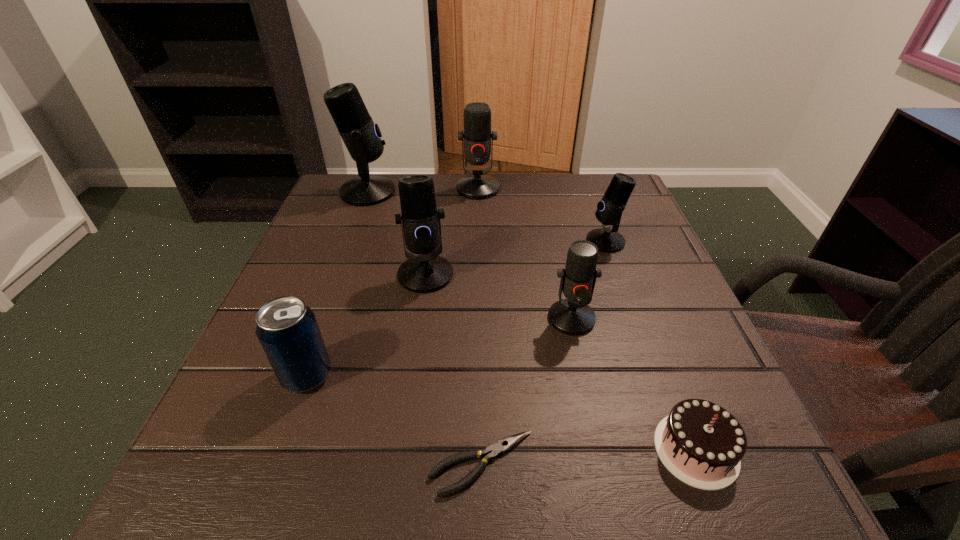
Identify which microphone is the third nearest to the bigger red microphone. Please provide its 2D coordinates. Your answer should be formatted as a tuple, i.e. [(x, y)], where the tuple contains the x and y coordinates of a point satisfying the conditions above.

[(427, 272)]

Identify the location of black microphone that is the nearest to the second nearest microphone. (361, 136).

The width and height of the screenshot is (960, 540). Identify the location of black microphone that stands as the second closest to the second nearest microphone. (609, 210).

Where is `vacant area in the image that satisfies the following two spatial constraints: 1. on the stand of the pliers; 2. on the left side of the fourth farthest microphone`? The height and width of the screenshot is (540, 960). vacant area in the image that satisfies the following two spatial constraints: 1. on the stand of the pliers; 2. on the left side of the fourth farthest microphone is located at coordinates (398, 463).

You are a GUI agent. You are given a task and a screenshot of the screen. Output one action in this format:
    pyautogui.click(x=<x>, y=<y>)
    Task: Click on the vacant space that satisfies the following two spatial constraints: 1. on the back side of the chocolate cake; 2. on the stand of the leftmost black microphone
    The height and width of the screenshot is (540, 960).
    Given the screenshot: What is the action you would take?
    pyautogui.click(x=596, y=192)

Locate an element on the screen. The height and width of the screenshot is (540, 960). vacant area that satisfies the following two spatial constraints: 1. on the side of the seventh tallest object with the red ring; 2. on the right side of the bigger red microphone is located at coordinates (477, 450).

This screenshot has height=540, width=960. I want to click on blank area in the image that satisfies the following two spatial constraints: 1. on the stand of the second shortest object; 2. on the right side of the second nearest black microphone, so click(x=681, y=450).

This screenshot has height=540, width=960. Find the location of `free space that satisfies the following two spatial constraints: 1. on the side of the second shortest object with the red ring; 2. on the left side of the farther red microphone`. free space that satisfies the following two spatial constraints: 1. on the side of the second shortest object with the red ring; 2. on the left side of the farther red microphone is located at coordinates (477, 450).

Locate an element on the screen. This screenshot has width=960, height=540. blank space that satisfies the following two spatial constraints: 1. on the stand of the pliers; 2. on the left side of the nearest black microphone is located at coordinates (398, 463).